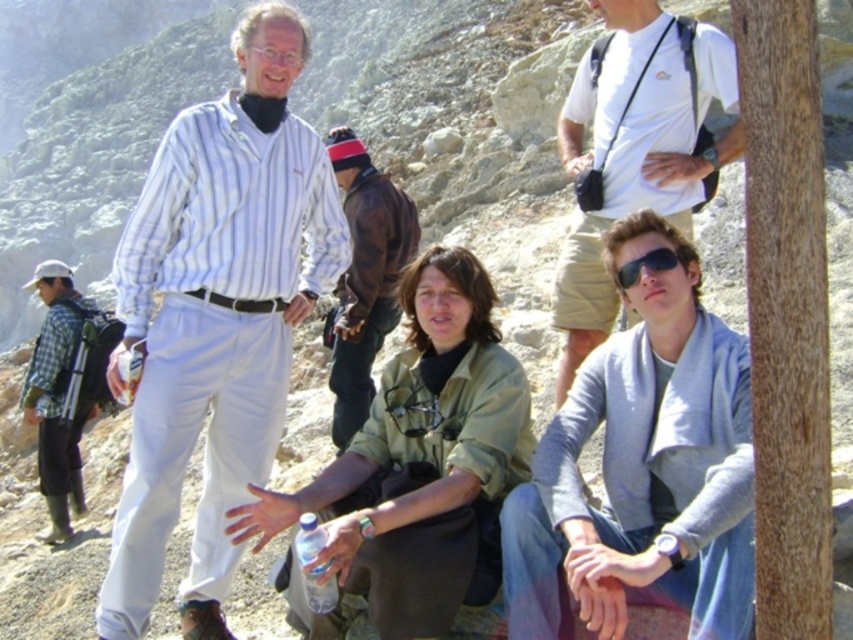
Based on the photo, you are a hiker who wants to locate the green matte jacket at center in the image. According to the coordinates provided, where would you look to find it?

The green matte jacket at center is located at point (422, 460) in the image.